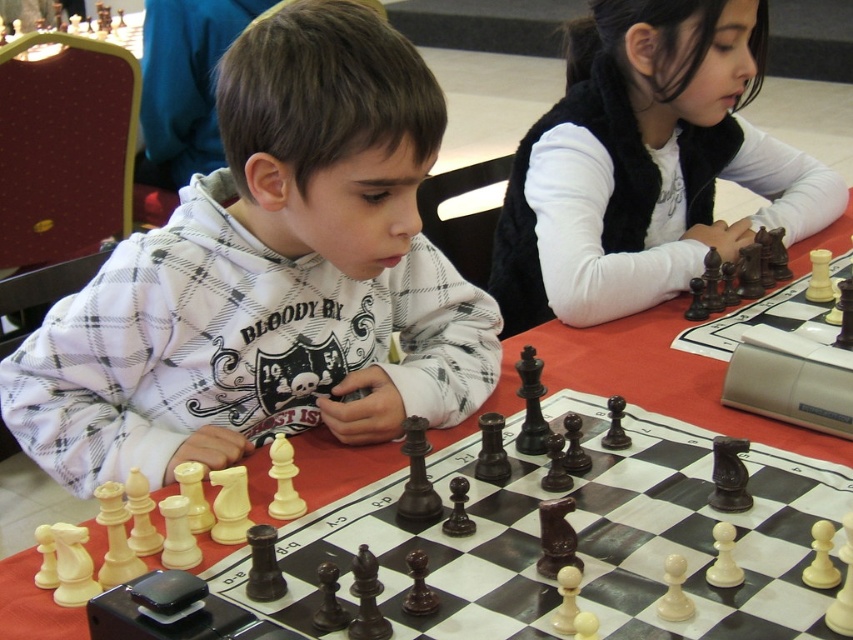
Is white fleece vest at upper right smaller than wooden chessboard at center?

Yes, white fleece vest at upper right is smaller than wooden chessboard at center.

In the scene shown: Can you confirm if white fleece vest at upper right is thinner than wooden chessboard at center?

Yes.

Which is behind, point (625, 189) or point (364, 472)?

Point (625, 189)

This screenshot has width=853, height=640. Identify the location of white fleece vest at upper right. [x=645, y=164].

Is white fleece hoodie at center to the left of white fleece vest at upper right from the viewer's perspective?

Indeed, white fleece hoodie at center is positioned on the left side of white fleece vest at upper right.

Does white fleece hoodie at center appear over white fleece vest at upper right?

No.

Find the location of `white fleece hoodie at center`. white fleece hoodie at center is located at coordinates (270, 276).

At what (x,y) coordinates should I click in order to perform the action: click on white fleece hoodie at center. Please return your answer as a coordinate pair (x, y). Looking at the image, I should click on (270, 276).

Does white fleece hoodie at center appear over wooden chessboard at center?

Yes.

Is the position of white fleece hoodie at center less distant than that of wooden chessboard at center?

No, white fleece hoodie at center is behind wooden chessboard at center.

Where is `white fleece hoodie at center`? The height and width of the screenshot is (640, 853). white fleece hoodie at center is located at coordinates (270, 276).

Where is `white fleece hoodie at center`? The image size is (853, 640). white fleece hoodie at center is located at coordinates (270, 276).